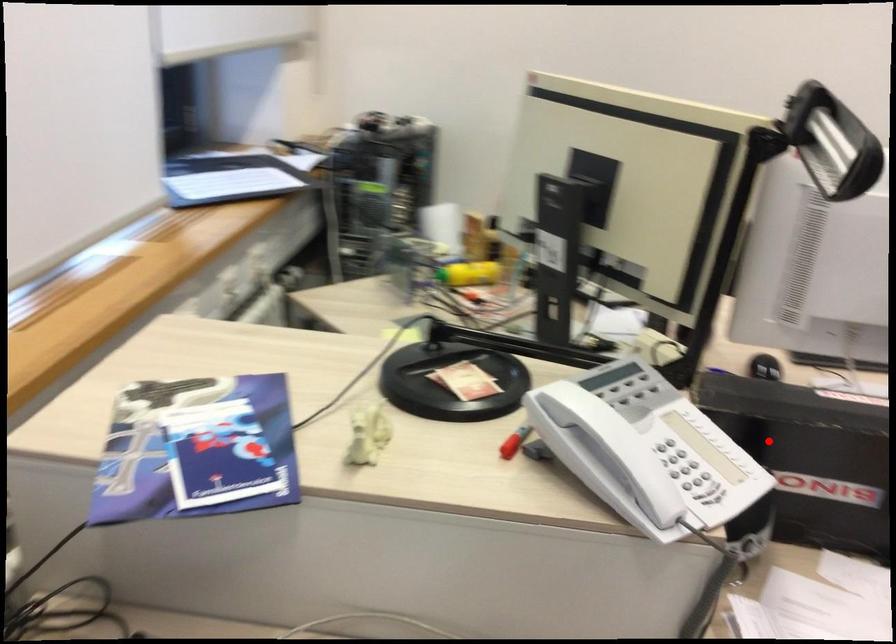
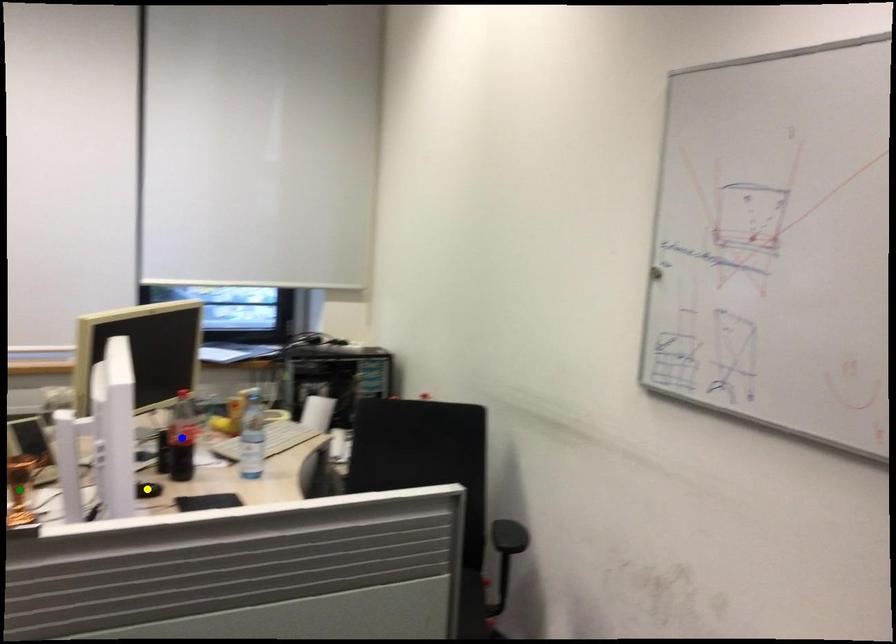
Question: I am providing you with two images of the same scene from different viewpoints. A red point is marked on the first image. You are given multiple points on the second image. Which spot in image 2 lines up with the point in image 1?

Choices:
 (A) green point
 (B) blue point
 (C) yellow point

Answer: (A)